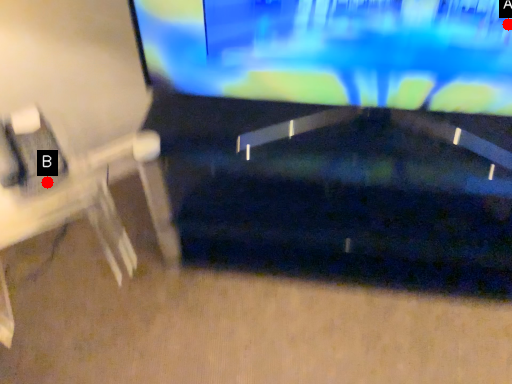
Question: Two points are circled on the image, labeled by A and B beside each circle. Which point appears farthest from the camera in this image?

Choices:
 (A) A is further
 (B) B is further

Answer: (B)